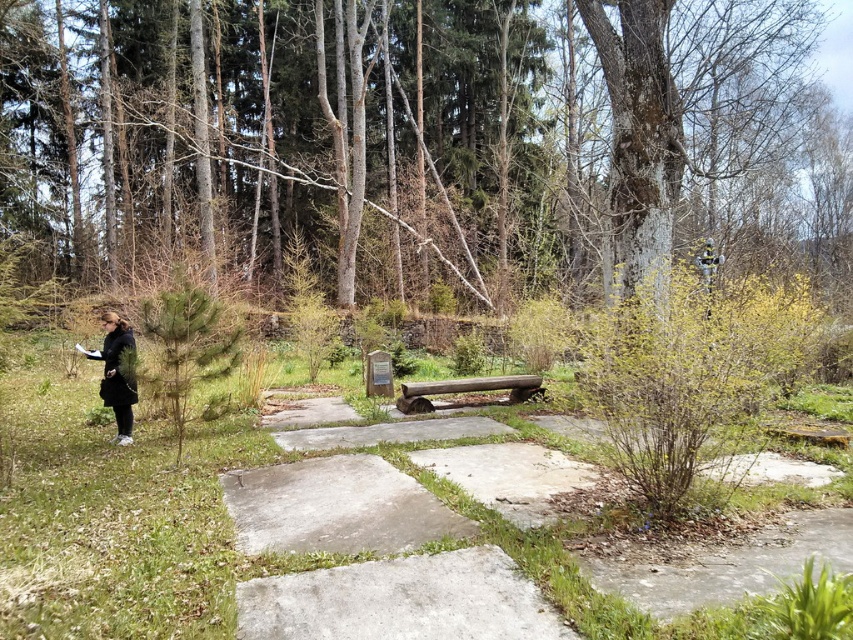
Can you confirm if brown bark tree at upper center is positioned below smooth wooden bench at center?

No, brown bark tree at upper center is not below smooth wooden bench at center.

Does brown bark tree at upper center have a larger size compared to smooth wooden bench at center?

Yes, brown bark tree at upper center is bigger than smooth wooden bench at center.

The width and height of the screenshot is (853, 640). What do you see at coordinates (416, 141) in the screenshot? I see `brown bark tree at upper center` at bounding box center [416, 141].

What are the coordinates of `brown bark tree at upper center` in the screenshot? It's located at (416, 141).

The width and height of the screenshot is (853, 640). What do you see at coordinates (335, 508) in the screenshot?
I see `smooth concrete path at center` at bounding box center [335, 508].

You are a GUI agent. You are given a task and a screenshot of the screen. Output one action in this format:
    pyautogui.click(x=<x>, y=<y>)
    Task: Click on the smooth concrete path at center
    
    Given the screenshot: What is the action you would take?
    pyautogui.click(x=335, y=508)

Does black fabric jacket at left appear on the right side of smooth wooden bench at center?

A: In fact, black fabric jacket at left is to the left of smooth wooden bench at center.

Can you confirm if black fabric jacket at left is smaller than smooth wooden bench at center?

Incorrect, black fabric jacket at left is not smaller in size than smooth wooden bench at center.

Identify the location of black fabric jacket at left. (115, 372).